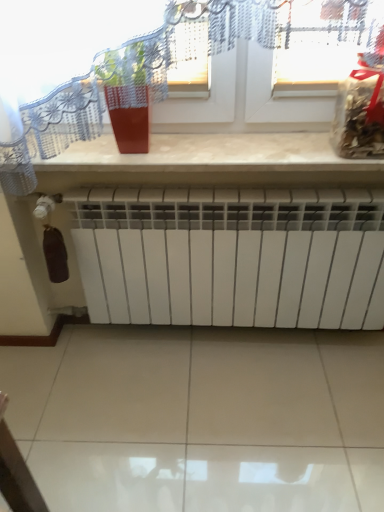
Question: From the image's perspective, relative to transparent glass window at upper center, is matte red pot at upper center above or below?

Choices:
 (A) below
 (B) above

Answer: (A)

Question: Does point (145, 74) appear closer or farther from the camera than point (266, 114)?

Choices:
 (A) closer
 (B) farther

Answer: (A)

Question: Estimate the real-world distances between objects in this image. Which object is farther from the white matte radiator at lower center?

Choices:
 (A) transparent glass window at upper center
 (B) matte red pot at upper center
 (C) beige marble counter at upper center
 (D) translucent plastic bag at upper right

Answer: (D)

Question: Which is nearer to the white matte radiator at lower center?

Choices:
 (A) translucent plastic bag at upper right
 (B) matte red pot at upper center
 (C) beige marble counter at upper center
 (D) transparent glass window at upper center

Answer: (C)